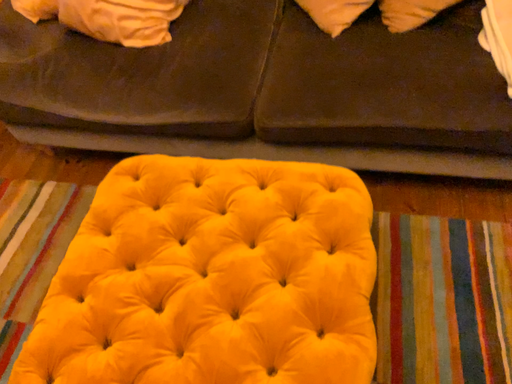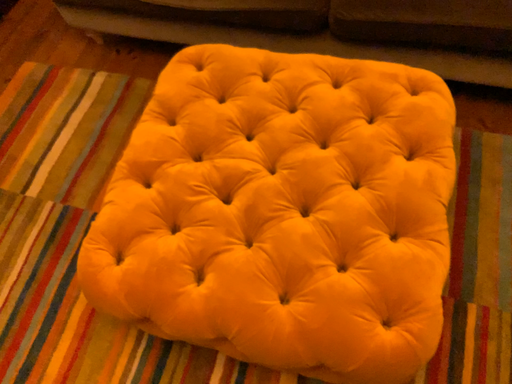
Question: Which way did the camera rotate in the video?

Choices:
 (A) rotated upward
 (B) rotated downward

Answer: (B)